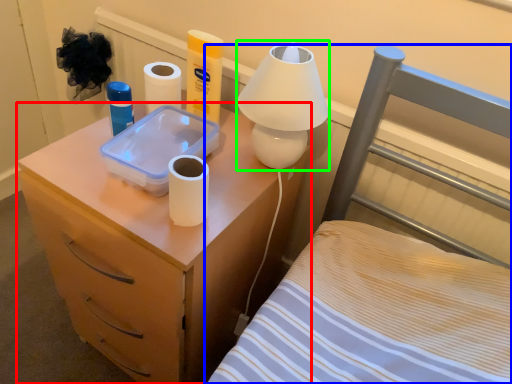
Question: Considering the real-world distances, which object is closest to nightstand (highlighted by a red box)? furniture (highlighted by a blue box) or table lamp (highlighted by a green box).

Choices:
 (A) furniture
 (B) table lamp

Answer: (A)